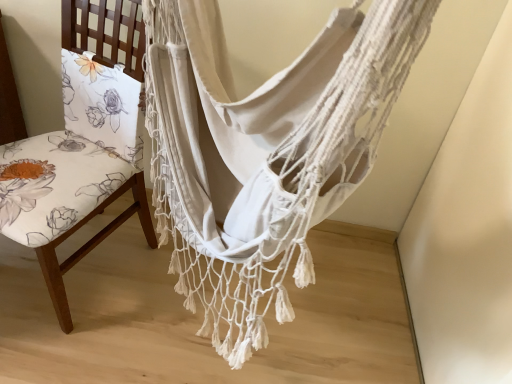
This screenshot has width=512, height=384. Describe the element at coordinates (263, 152) in the screenshot. I see `white woven hammock at center` at that location.

Locate an element on the screen. The height and width of the screenshot is (384, 512). white woven hammock at center is located at coordinates (263, 152).

Where is `floral fabric chair at left`? floral fabric chair at left is located at coordinates (91, 245).

What do you see at coordinates (91, 245) in the screenshot?
I see `floral fabric chair at left` at bounding box center [91, 245].

Locate an element on the screen. The height and width of the screenshot is (384, 512). white woven hammock at center is located at coordinates (263, 152).

Considering the relative positions of white woven hammock at center and floral fabric chair at left in the image provided, is white woven hammock at center to the right of floral fabric chair at left from the viewer's perspective?

Yes, white woven hammock at center is to the right of floral fabric chair at left.

In the image, is white woven hammock at center positioned in front of or behind floral fabric chair at left?

white woven hammock at center is positioned closer to the viewer than floral fabric chair at left.

Is point (343, 68) closer or farther from the camera than point (5, 42)?

Point (343, 68).

From the image's perspective, would you say white woven hammock at center is positioned over floral fabric chair at left?

No.

From a real-world perspective, is white woven hammock at center located higher than floral fabric chair at left?

Yes, from a real-world perspective, white woven hammock at center is on top of floral fabric chair at left.

From the picture: Which object is thinner, white woven hammock at center or floral fabric chair at left?

With smaller width is white woven hammock at center.

Consider the image. Does white woven hammock at center have a lesser height compared to floral fabric chair at left?

Indeed, white woven hammock at center has a lesser height compared to floral fabric chair at left.

Can you confirm if white woven hammock at center is bigger than floral fabric chair at left?

Yes.

Is white woven hammock at center inside or outside of floral fabric chair at left?

white woven hammock at center is located beyond the bounds of floral fabric chair at left.

Is white woven hammock at center far away from floral fabric chair at left?

No, there isn't a large distance between white woven hammock at center and floral fabric chair at left.

Is floral fabric chair at left at the back of white woven hammock at center?

No, floral fabric chair at left is not at the back of white woven hammock at center.

Looking at this image, how different are the orientations of white woven hammock at center and floral fabric chair at left in degrees?

The angle between the facing direction of white woven hammock at center and the facing direction of floral fabric chair at left is 26.6 degrees.

This screenshot has height=384, width=512. Find the location of `chair below the white woven hammock at center (from a real-world perspective)`. chair below the white woven hammock at center (from a real-world perspective) is located at coordinates (91, 245).

Which object is positioned more to the right, floral fabric chair at left or white woven hammock at center?

white woven hammock at center.

Relative to white woven hammock at center, is floral fabric chair at left in front or behind?

floral fabric chair at left is behind white woven hammock at center.

Which is behind, point (144, 210) or point (389, 79)?

The point (144, 210) is farther.

From the image's perspective, is floral fabric chair at left located beneath white woven hammock at center?

Actually, floral fabric chair at left appears above white woven hammock at center in the image.

From a real-world perspective, is floral fabric chair at left below white woven hammock at center?

Yes, from a real-world perspective, floral fabric chair at left is under white woven hammock at center.

Between floral fabric chair at left and white woven hammock at center, which one has smaller width?

white woven hammock at center is thinner.

Between floral fabric chair at left and white woven hammock at center, which one has less height?

With less height is white woven hammock at center.

Considering the relative sizes of floral fabric chair at left and white woven hammock at center in the image provided, is floral fabric chair at left smaller than white woven hammock at center?

Yes, floral fabric chair at left is smaller than white woven hammock at center.

Is floral fabric chair at left completely or partially outside of white woven hammock at center?

Yes, floral fabric chair at left is outside of white woven hammock at center.

Is floral fabric chair at left far from white woven hammock at center?

No, there isn't a large distance between floral fabric chair at left and white woven hammock at center.

Is floral fabric chair at left oriented away from white woven hammock at center?

Yes.

Locate an element on the screen. chair behind the white woven hammock at center is located at coordinates (91, 245).

At what (x,y) coordinates should I click in order to perform the action: click on chair behind the white woven hammock at center. Please return your answer as a coordinate pair (x, y). The width and height of the screenshot is (512, 384). Looking at the image, I should click on (91, 245).

Identify the location of chair above the white woven hammock at center (from the image's perspective). This screenshot has height=384, width=512. (91, 245).